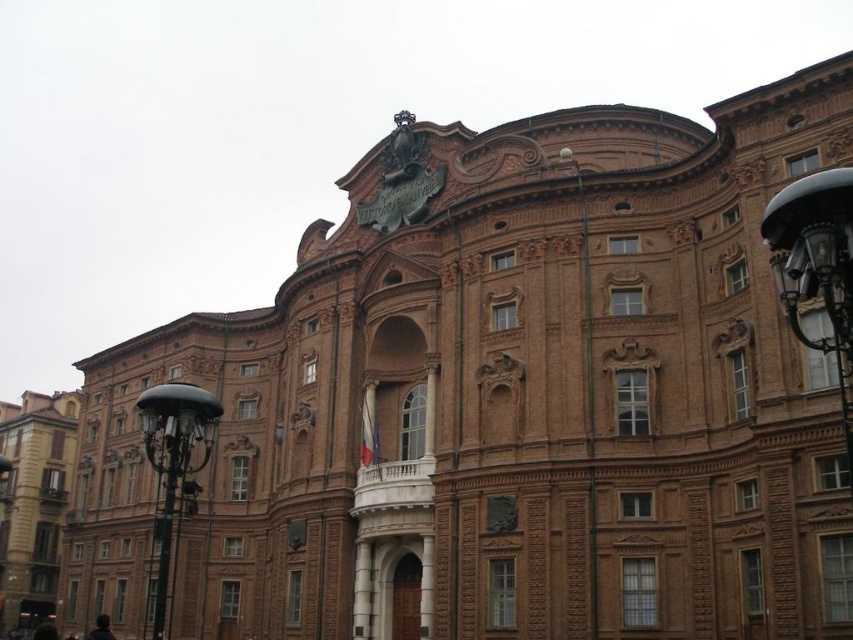
Is brown brick building at lower left below polished black lamp post at left?

Indeed, brown brick building at lower left is positioned under polished black lamp post at left.

Is brown brick building at lower left thinner than polished black lamp post at left?

No.

The height and width of the screenshot is (640, 853). In order to click on brown brick building at lower left in this screenshot , I will do `click(33, 502)`.

Is black metal lamp post at right bigger than polished black lamp post at left?

Actually, black metal lamp post at right might be smaller than polished black lamp post at left.

The image size is (853, 640). What are the coordinates of `black metal lamp post at right` in the screenshot? It's located at (816, 266).

Which is more to the left, brown brick building at lower left or polished brass lamp post at center?

brown brick building at lower left

Does brown brick building at lower left have a greater height compared to polished brass lamp post at center?

No.

Locate an element on the screen. This screenshot has width=853, height=640. brown brick building at lower left is located at coordinates (33, 502).